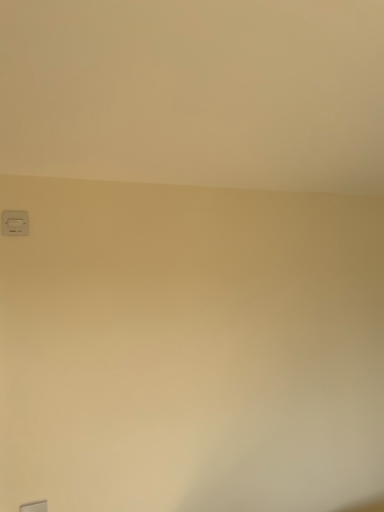
Question: Based on their positions, is white plastic light switch at upper left located to the left or right of transparent glass window at lower left?

Choices:
 (A) left
 (B) right

Answer: (A)

Question: Is point (23, 217) closer or farther from the camera than point (33, 501)?

Choices:
 (A) closer
 (B) farther

Answer: (B)

Question: From the image's perspective, is white plastic light switch at upper left above or below transparent glass window at lower left?

Choices:
 (A) above
 (B) below

Answer: (A)

Question: Is transparent glass window at lower left taller or shorter than white plastic light switch at upper left?

Choices:
 (A) tall
 (B) short

Answer: (B)

Question: In terms of width, does transparent glass window at lower left look wider or thinner when compared to white plastic light switch at upper left?

Choices:
 (A) wide
 (B) thin

Answer: (B)

Question: Is transparent glass window at lower left situated inside white plastic light switch at upper left or outside?

Choices:
 (A) inside
 (B) outside

Answer: (B)

Question: From the image's perspective, relative to white plastic light switch at upper left, is transparent glass window at lower left above or below?

Choices:
 (A) below
 (B) above

Answer: (A)